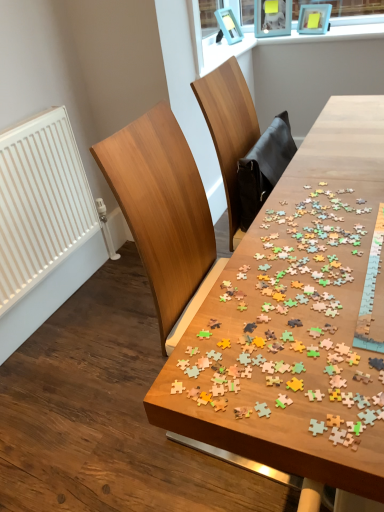
Question: Is wooden puzzle pieces at center completely or partially outside of white matte radiator at left?

Choices:
 (A) no
 (B) yes

Answer: (B)

Question: Considering the relative sizes of wooden puzzle pieces at center and white matte radiator at left in the image provided, is wooden puzzle pieces at center wider than white matte radiator at left?

Choices:
 (A) yes
 (B) no

Answer: (A)

Question: Is wooden puzzle pieces at center positioned with its back to white matte radiator at left?

Choices:
 (A) yes
 (B) no

Answer: (B)

Question: Considering the relative sizes of wooden puzzle pieces at center and white matte radiator at left in the image provided, is wooden puzzle pieces at center bigger than white matte radiator at left?

Choices:
 (A) no
 (B) yes

Answer: (B)

Question: Is wooden puzzle pieces at center in front of white matte radiator at left?

Choices:
 (A) yes
 (B) no

Answer: (A)

Question: Is wooden puzzle pieces at center aimed at white matte radiator at left?

Choices:
 (A) no
 (B) yes

Answer: (A)

Question: Can you confirm if white matte radiator at left is wider than wooden puzzle pieces at center?

Choices:
 (A) no
 (B) yes

Answer: (A)

Question: Can you confirm if white matte radiator at left is positioned to the right of wooden puzzle pieces at center?

Choices:
 (A) no
 (B) yes

Answer: (A)

Question: Is white matte radiator at left not inside wooden puzzle pieces at center?

Choices:
 (A) yes
 (B) no

Answer: (A)

Question: Is white matte radiator at left looking in the opposite direction of wooden puzzle pieces at center?

Choices:
 (A) yes
 (B) no

Answer: (B)

Question: Does white matte radiator at left have a larger size compared to wooden puzzle pieces at center?

Choices:
 (A) yes
 (B) no

Answer: (B)

Question: Does white matte radiator at left have a lesser width compared to wooden puzzle pieces at center?

Choices:
 (A) no
 (B) yes

Answer: (B)

Question: From a real-world perspective, is wooden puzzle pieces at center physically located above or below white matte radiator at left?

Choices:
 (A) below
 (B) above

Answer: (A)